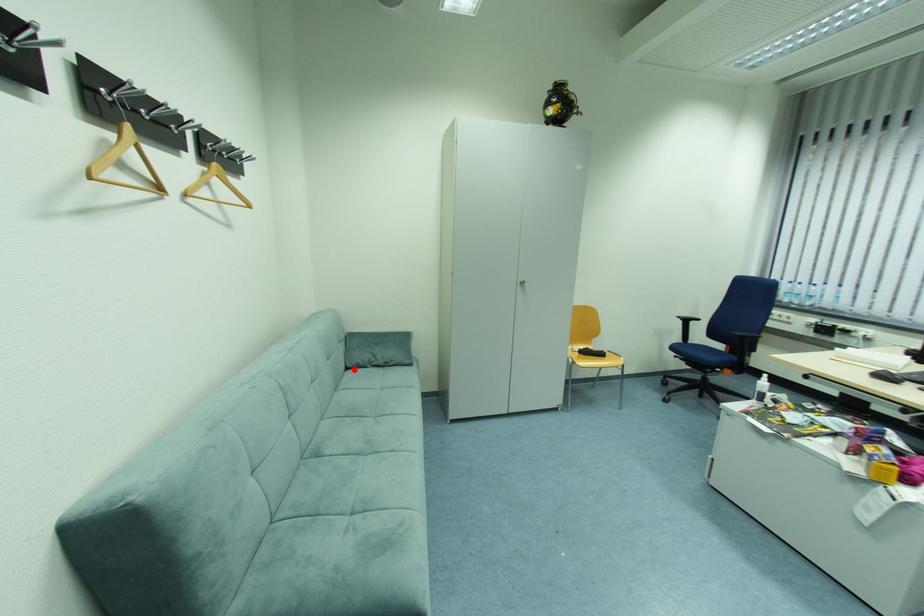
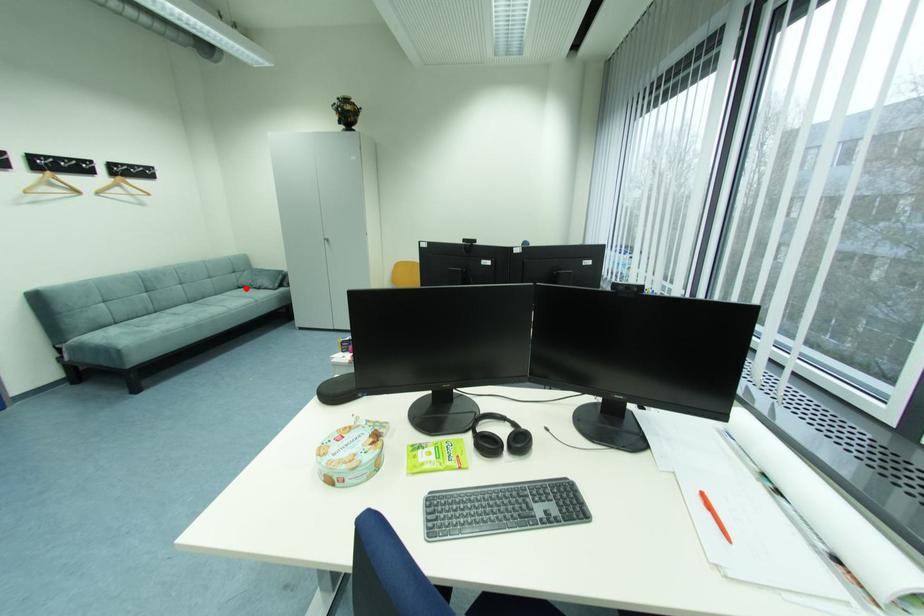
I am providing you with two images of the same scene from different viewpoints. A red point is marked on the first image and another point is marked on the second image. Does the point marked in image1 correspond to the same location as the one in image2?

Yes